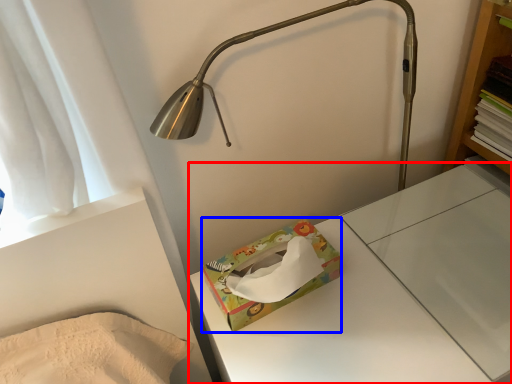
Question: Which of the following is the farthest to the observer, changing table (highlighted by a red box) or package (highlighted by a blue box)?

Choices:
 (A) changing table
 (B) package

Answer: (B)